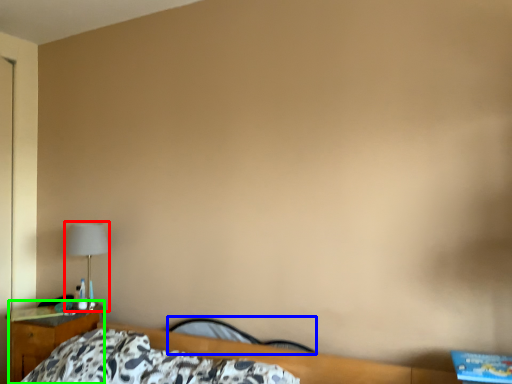
Question: Which object is the farthest from lamp (highlighted by a red box)? Choose among these: chair (highlighted by a blue box) or nightstand (highlighted by a green box).

Choices:
 (A) chair
 (B) nightstand

Answer: (A)